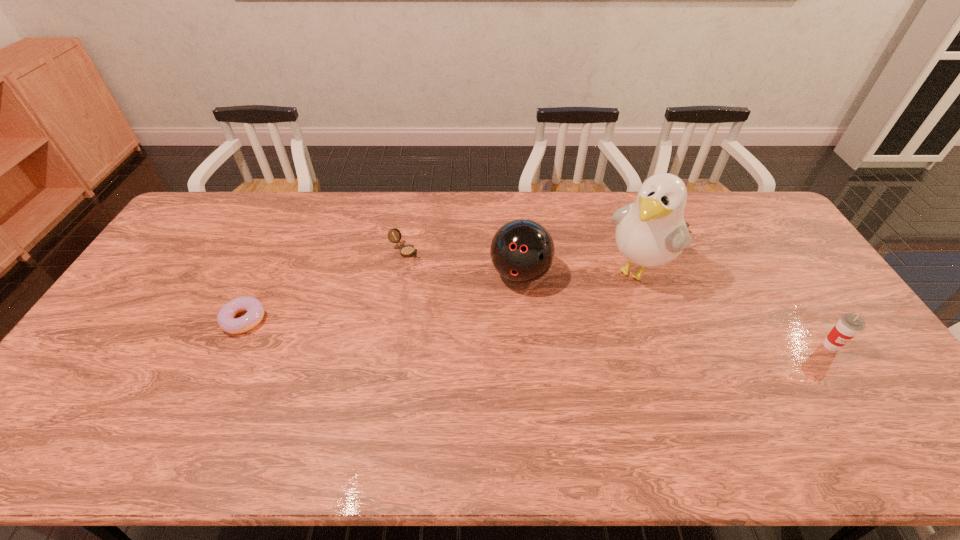
Locate an element on the screen. The width and height of the screenshot is (960, 540). doughnut is located at coordinates (226, 319).

I want to click on the leftmost object, so click(226, 319).

Where is `cup`? This screenshot has height=540, width=960. cup is located at coordinates (849, 325).

At what (x,y) coordinates should I click in order to perform the action: click on the rightmost object. Please return your answer as a coordinate pair (x, y). This screenshot has height=540, width=960. Looking at the image, I should click on (849, 325).

At what (x,y) coordinates should I click in order to perform the action: click on gull. Please return your answer as a coordinate pair (x, y). This screenshot has width=960, height=540. Looking at the image, I should click on (650, 232).

Locate an element on the screen. This screenshot has width=960, height=540. the tallest object is located at coordinates (650, 232).

What are the coordinates of `the fourth shortest object` in the screenshot? It's located at [x=522, y=251].

The image size is (960, 540). Find the location of `the third object from left to right`. the third object from left to right is located at coordinates coord(522,251).

What are the coordinates of `the fourth tallest object` in the screenshot? It's located at (406, 251).

Locate an element on the screen. compass is located at coordinates (406, 251).